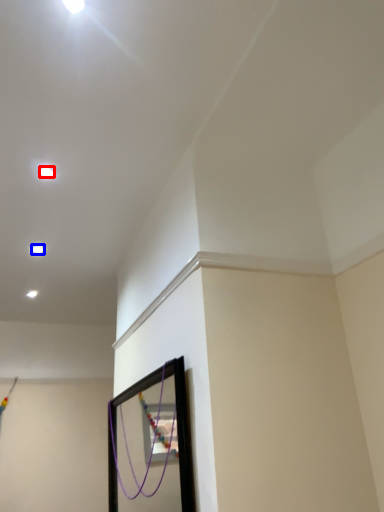
Question: Which of the following is the farthest to the observer, light (highlighted by a red box) or light (highlighted by a blue box)?

Choices:
 (A) light
 (B) light

Answer: (B)